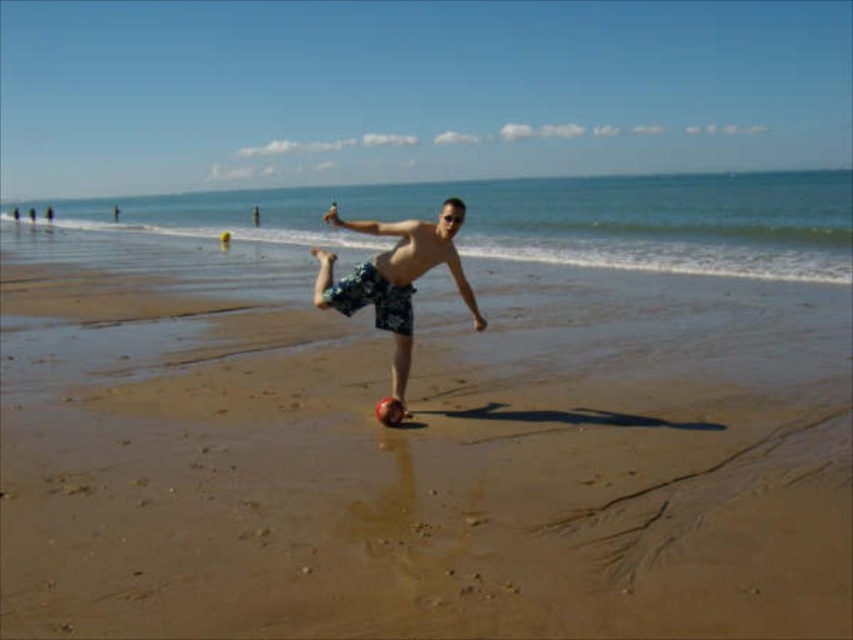
Who is higher up, floral shorts at center or floral-patterned shorts at center?

Positioned higher is floral shorts at center.

Can you confirm if floral shorts at center is positioned to the right of floral-patterned shorts at center?

Yes, floral shorts at center is to the right of floral-patterned shorts at center.

Where is `floral shorts at center`? floral shorts at center is located at coordinates (395, 276).

Is sandy beach at center to the left of floral shorts at center from the viewer's perspective?

Correct, you'll find sandy beach at center to the left of floral shorts at center.

Based on the photo, does sandy beach at center have a lesser width compared to floral shorts at center?

In fact, sandy beach at center might be wider than floral shorts at center.

Is point (544, 625) positioned after point (445, 234)?

That is False.

Locate an element on the screen. This screenshot has width=853, height=640. sandy beach at center is located at coordinates (405, 492).

Which is below, sandy beach at center or floral-patterned shorts at center?

sandy beach at center is below.

Which is behind, point (352, 445) or point (395, 308)?

The point (395, 308) is behind.

You are a GUI agent. You are given a task and a screenshot of the screen. Output one action in this format:
    pyautogui.click(x=<x>, y=<y>)
    Task: Click on the sandy beach at center
    This screenshot has height=640, width=853.
    Given the screenshot: What is the action you would take?
    point(405,492)